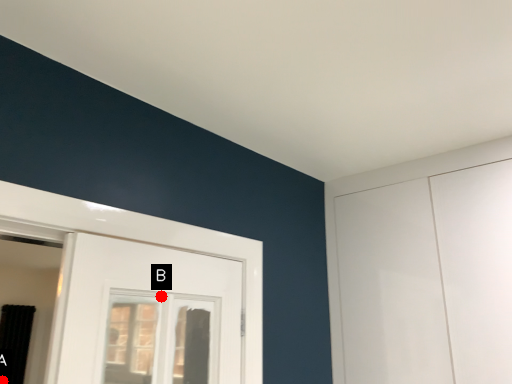
Question: Two points are circled on the image, labeled by A and B beside each circle. Which point is closer to the camera?

Choices:
 (A) A is closer
 (B) B is closer

Answer: (B)